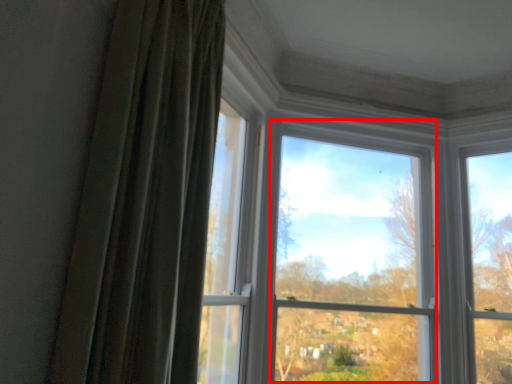
Question: Observing the image, what is the correct spatial positioning of bay window (annotated by the red box) in reference to curtain?

Choices:
 (A) right
 (B) left

Answer: (A)